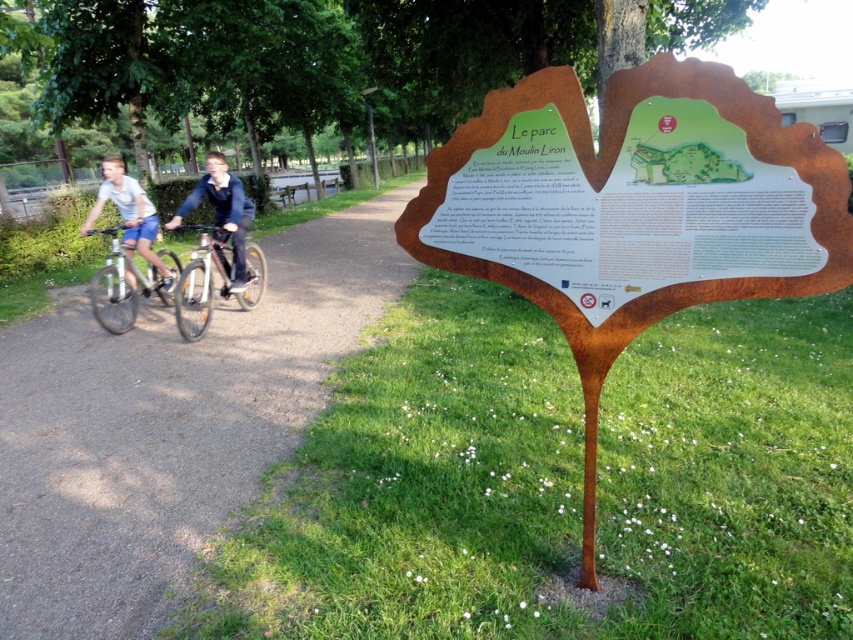
Question: Which of the following is the farthest from the observer?

Choices:
 (A) (160, 545)
 (B) (216, 225)
 (C) (131, 310)
 (D) (119, 192)

Answer: (C)

Question: Is silver metallic bicycle at center wider than blue denim jacket at center?

Choices:
 (A) yes
 (B) no

Answer: (B)

Question: Considering the real-world distances, which object is farthest from the matte white bicycles at left?

Choices:
 (A) matte white shirt at left
 (B) silver metallic bicycle at center

Answer: (A)

Question: Does gravel path at center appear on the right side of blue denim jacket at center?

Choices:
 (A) yes
 (B) no

Answer: (A)

Question: Is gravel path at center above matte white bicycles at left?

Choices:
 (A) no
 (B) yes

Answer: (A)

Question: Based on their relative distances, which object is farther from the gravel path at center?

Choices:
 (A) blue denim jacket at center
 (B) silver metallic bicycle at center
 (C) white matte bicycle at left
 (D) matte white shirt at left

Answer: (D)